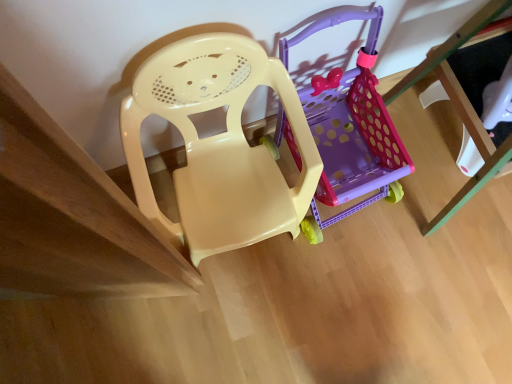
Where is `free spot to the right of translucent purple plastic shopping cart at center`? This screenshot has height=384, width=512. free spot to the right of translucent purple plastic shopping cart at center is located at coordinates (435, 208).